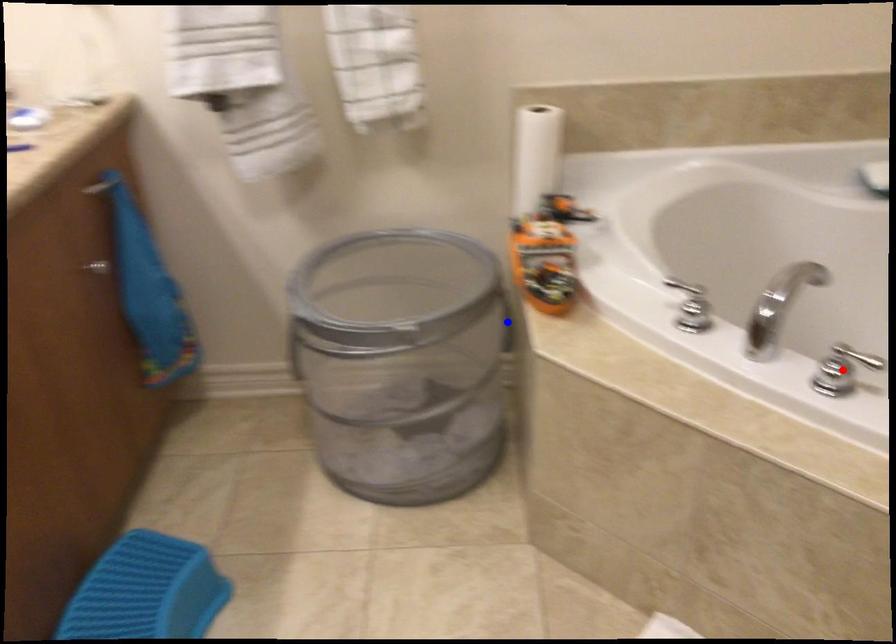
Question: In the image, two points are highlighted. Which point is nearer to the camera? Reply with the corresponding letter.

Choices:
 (A) blue point
 (B) red point

Answer: (B)